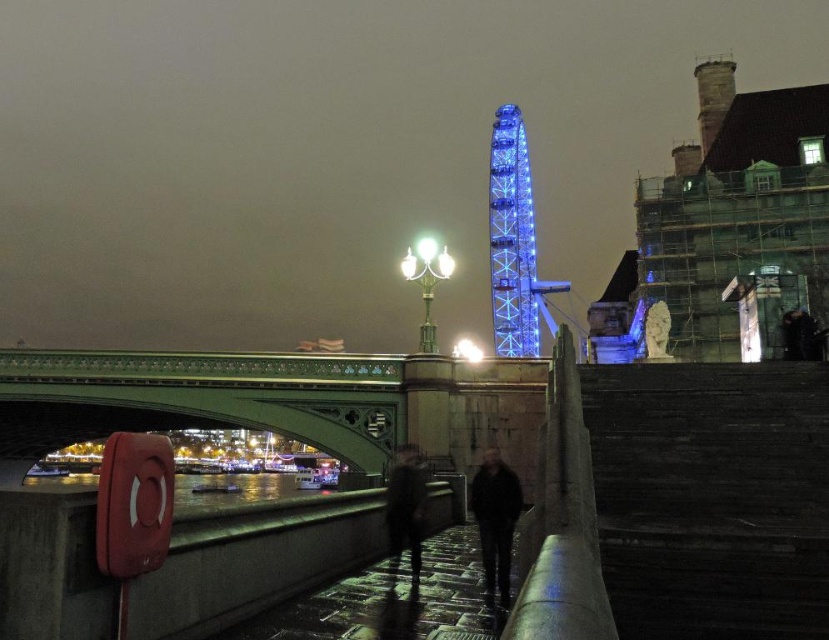
Does green stone bridge at lower left have a greater height compared to black matte jacket at center?

Yes.

Is green stone bridge at lower left positioned at the back of black matte jacket at center?

Yes, it is.

Who is more distant from viewer, [151,356] or [510,529]?

The point [151,356] is more distant.

Identify the location of green stone bridge at lower left. (275, 401).

Between black matte jacket at center and dark fabric jacket at center, which one appears on the right side from the viewer's perspective?

black matte jacket at center is more to the right.

Does black matte jacket at center have a greater height compared to dark fabric jacket at center?

Correct, black matte jacket at center is much taller as dark fabric jacket at center.

Is point (478, 532) farther from viewer compared to point (424, 458)?

No, it is not.

Locate an element on the screen. black matte jacket at center is located at coordinates pos(495,520).

Can you confirm if blue glass ferris wheel at upper center is positioned to the right of black matte jacket at center?

Indeed, blue glass ferris wheel at upper center is positioned on the right side of black matte jacket at center.

Between blue glass ferris wheel at upper center and black matte jacket at center, which one appears on the right side from the viewer's perspective?

blue glass ferris wheel at upper center

The width and height of the screenshot is (829, 640). I want to click on blue glass ferris wheel at upper center, so click(514, 243).